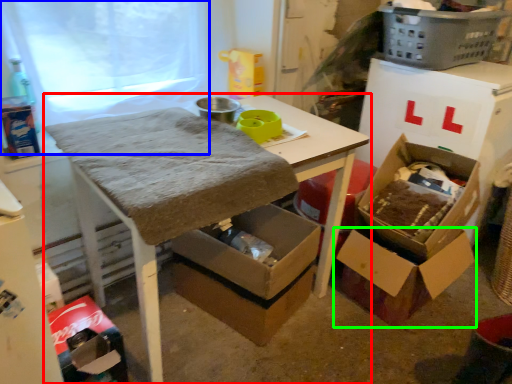
Question: Which object is the farthest from table (highlighted by a red box)? Choose among these: window screen (highlighted by a blue box) or box (highlighted by a green box).

Choices:
 (A) window screen
 (B) box

Answer: (A)